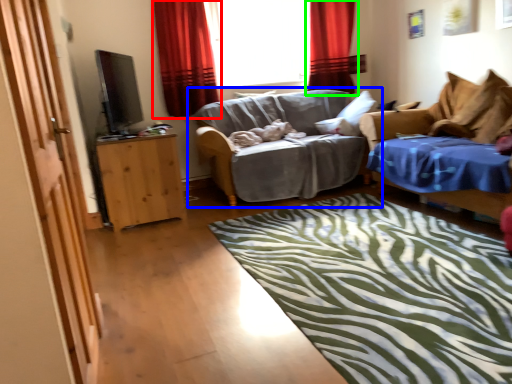
Question: Which object is positioned farthest from curtain (highlighted by a red box)? Select from studio couch (highlighted by a blue box) and curtain (highlighted by a green box).

Choices:
 (A) studio couch
 (B) curtain

Answer: (B)